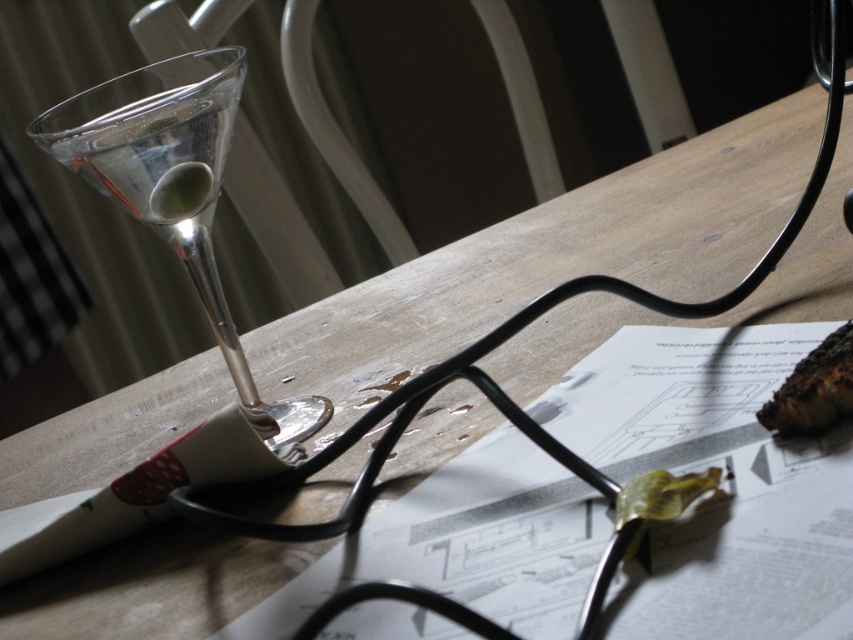
Question: Estimate the real-world distances between objects in this image. Which object is farther from the charcoal black bread at lower right?

Choices:
 (A) clear glass martini glass at left
 (B) white paper at center
 (C) green leafy vegetable at center

Answer: (A)

Question: Can you confirm if clear glass martini glass at left is positioned above green leafy vegetable at center?

Choices:
 (A) yes
 (B) no

Answer: (A)

Question: Which point appears farthest from the camera in this image?

Choices:
 (A) (724, 474)
 (B) (190, 138)

Answer: (B)

Question: Based on their relative distances, which object is nearer to the green leafy vegetable at center?

Choices:
 (A) white paper at center
 (B) charcoal black bread at lower right

Answer: (B)

Question: Does white paper at center come behind charcoal black bread at lower right?

Choices:
 (A) no
 (B) yes

Answer: (A)

Question: Can you confirm if white paper at center is bigger than green leafy vegetable at center?

Choices:
 (A) no
 (B) yes

Answer: (B)